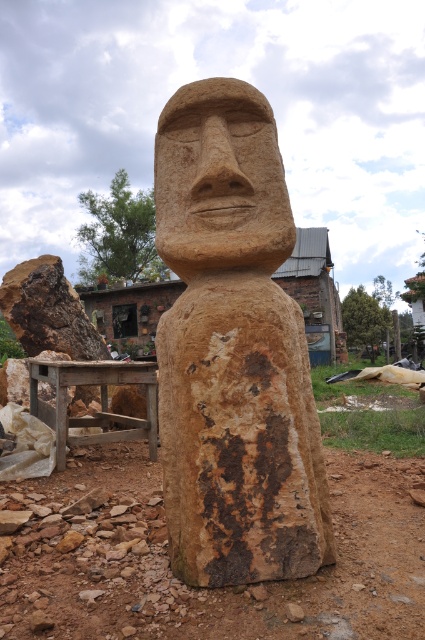
Is brown stone statue at center bigger than brown stone face at center?

Yes, brown stone statue at center is bigger than brown stone face at center.

Does brown stone statue at center have a greater width compared to brown stone face at center?

Correct, the width of brown stone statue at center exceeds that of brown stone face at center.

Between point (266, 321) and point (218, 141), which one is positioned in front?

Point (266, 321) is more forward.

The width and height of the screenshot is (425, 640). I want to click on brown stone statue at center, so click(232, 349).